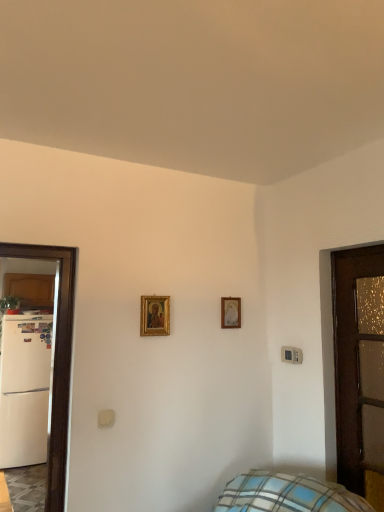
Question: Does gold-framed painting at center, marked as the 1th picture frame in a left-to-right arrangement, lie behind brown wooden door at right?

Choices:
 (A) no
 (B) yes

Answer: (B)

Question: Is gold-framed painting at center, marked as the 2th picture frame in a right-to-left arrangement, not near brown wooden door at right?

Choices:
 (A) yes
 (B) no

Answer: (B)

Question: Considering the relative sizes of gold-framed painting at center, which is the 1th picture frame in front-to-back order, and brown wooden door at right in the image provided, is gold-framed painting at center, which is the 1th picture frame in front-to-back order, thinner than brown wooden door at right?

Choices:
 (A) no
 (B) yes

Answer: (B)

Question: Can you confirm if gold-framed painting at center, positioned as the 2th picture frame in back-to-front order, is taller than brown wooden door at right?

Choices:
 (A) yes
 (B) no

Answer: (B)

Question: From the image's perspective, is gold-framed painting at center, marked as the 2th picture frame in a right-to-left arrangement, on brown wooden door at right?

Choices:
 (A) no
 (B) yes

Answer: (B)

Question: Does gold-framed painting at center, positioned as the 2th picture frame in back-to-front order, have a smaller size compared to brown wooden door at right?

Choices:
 (A) yes
 (B) no

Answer: (A)

Question: Can you confirm if gold-framed picture at center, arranged as the 1th picture frame when viewed from the back, is shorter than brown wooden door at right?

Choices:
 (A) no
 (B) yes

Answer: (B)

Question: Can you confirm if gold-framed picture at center, arranged as the second picture frame when viewed from the front, is wider than brown wooden door at right?

Choices:
 (A) yes
 (B) no

Answer: (B)

Question: Does gold-framed picture at center, the 2th picture frame viewed from the left, turn towards brown wooden door at right?

Choices:
 (A) no
 (B) yes

Answer: (A)

Question: Can we say gold-framed picture at center, arranged as the second picture frame when viewed from the front, lies outside brown wooden door at right?

Choices:
 (A) yes
 (B) no

Answer: (A)

Question: From a real-world perspective, is gold-framed picture at center, arranged as the 1th picture frame when viewed from the back, below brown wooden door at right?

Choices:
 (A) no
 (B) yes

Answer: (A)

Question: Is gold-framed picture at center, arranged as the 1th picture frame when viewed from the back, looking in the opposite direction of brown wooden door at right?

Choices:
 (A) yes
 (B) no

Answer: (B)

Question: Does gold-framed painting at center, marked as the 2th picture frame in a right-to-left arrangement, have a larger size compared to gold-framed picture at center, the 2th picture frame viewed from the left?

Choices:
 (A) yes
 (B) no

Answer: (A)